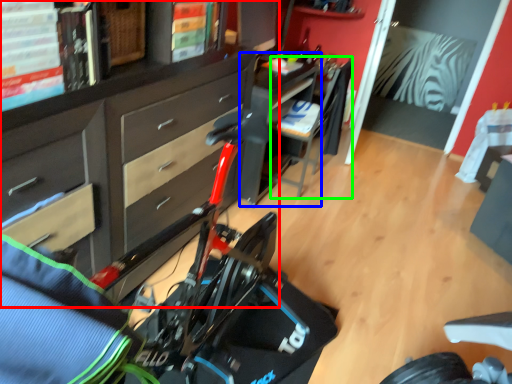
Question: Which object is the farthest from cabinetry (highlighted by a red box)? Choose among these: table (highlighted by a blue box) or chair (highlighted by a green box).

Choices:
 (A) table
 (B) chair

Answer: (B)